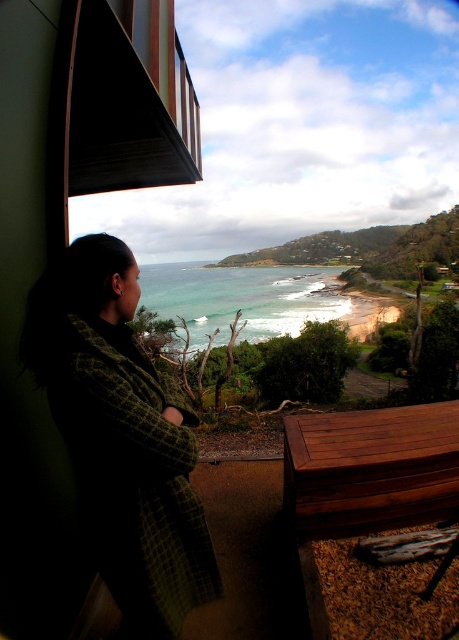
Question: Is rustic wood balcony at upper left further to the viewer compared to green water at center?

Choices:
 (A) yes
 (B) no

Answer: (B)

Question: Which point appears farthest from the camera in this image?

Choices:
 (A) (62, 269)
 (B) (164, 42)
 (C) (252, 340)

Answer: (C)

Question: Which point is closer to the camera?

Choices:
 (A) [229, 308]
 (B) [107, 160]
 (C) [72, 376]

Answer: (C)

Question: Can you confirm if rustic wood balcony at upper left is bigger than green water at center?

Choices:
 (A) no
 (B) yes

Answer: (A)

Question: Does green checkered coat at left have a smaller size compared to green water at center?

Choices:
 (A) no
 (B) yes

Answer: (B)

Question: Which of the following is the farthest from the observer?

Choices:
 (A) pos(166,636)
 (B) pos(157,310)

Answer: (B)